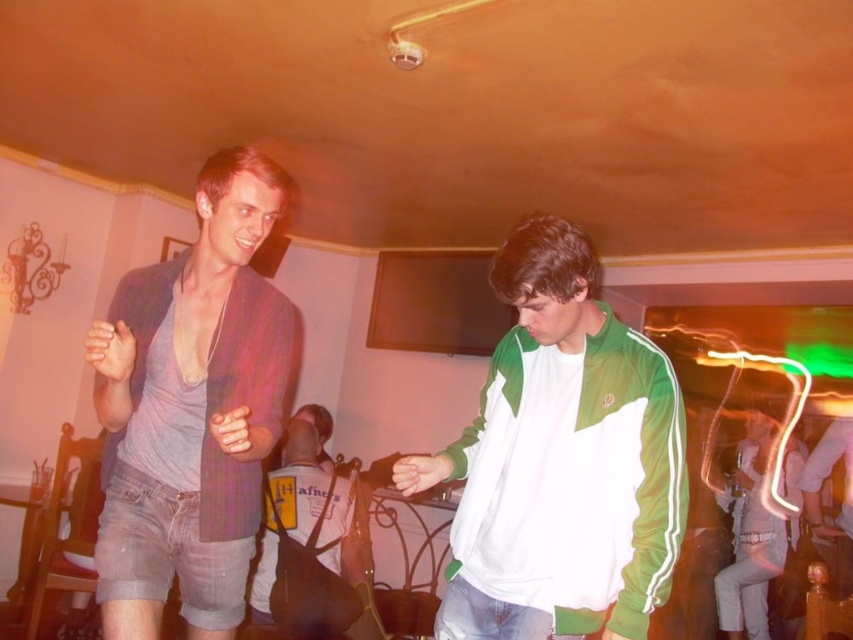
Can you confirm if matte purple shirt at left is wider than yellow fabric backpack at center?

Incorrect, matte purple shirt at left's width does not surpass yellow fabric backpack at center's.

Is matte purple shirt at left to the left of yellow fabric backpack at center from the viewer's perspective?

In fact, matte purple shirt at left is to the right of yellow fabric backpack at center.

This screenshot has height=640, width=853. Find the location of `matte purple shirt at left`. matte purple shirt at left is located at coordinates (190, 410).

Find the location of a particular element. The width and height of the screenshot is (853, 640). matte purple shirt at left is located at coordinates (190, 410).

The width and height of the screenshot is (853, 640). What are the coordinates of `yellow fabric backpack at center` in the screenshot? It's located at (305, 545).

Who is more distant from viewer, (318, 468) or (779, 518)?

Positioned behind is point (779, 518).

Which is in front, point (326, 563) or point (733, 545)?

Point (326, 563)

Image resolution: width=853 pixels, height=640 pixels. What are the coordinates of `yellow fabric backpack at center` in the screenshot? It's located at point(305,545).

Is white/green track jacket at center wider than yellow fabric backpack at center?

Yes, white/green track jacket at center is wider than yellow fabric backpack at center.

Does white/green track jacket at center appear on the right side of yellow fabric backpack at center?

Correct, you'll find white/green track jacket at center to the right of yellow fabric backpack at center.

Find the location of a particular element. white/green track jacket at center is located at coordinates (561, 461).